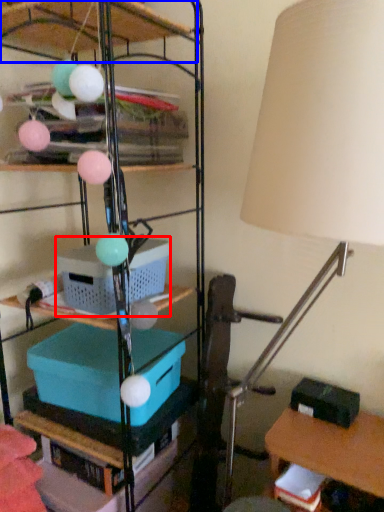
Question: Which object appears farthest to the camera in this image, storage box (highlighted by a red box) or shelf (highlighted by a blue box)?

Choices:
 (A) storage box
 (B) shelf

Answer: (A)